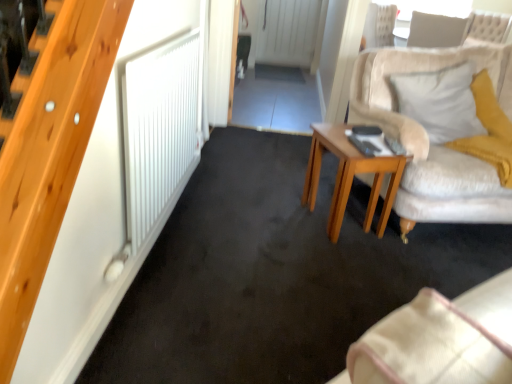
At what (x,y) coordinates should I click in order to perform the action: click on vacant space in wooden side table at center (from a real-world perspective). Please return your answer as a coordinate pair (x, y). This screenshot has width=512, height=384. Looking at the image, I should click on (347, 219).